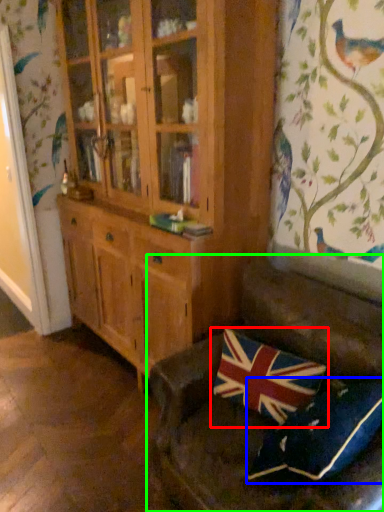
Question: Which object is positioned farthest from pillow (highlighted by a red box)? Select from pillow (highlighted by a blue box) and studio couch (highlighted by a green box).

Choices:
 (A) pillow
 (B) studio couch

Answer: (A)